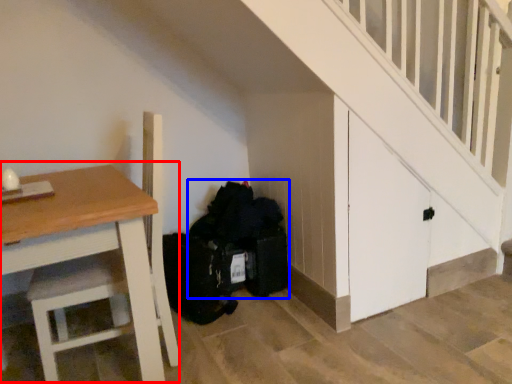
Question: Which object appears farthest to the camera in this image, table (highlighted by a red box) or garbage (highlighted by a blue box)?

Choices:
 (A) table
 (B) garbage

Answer: (B)